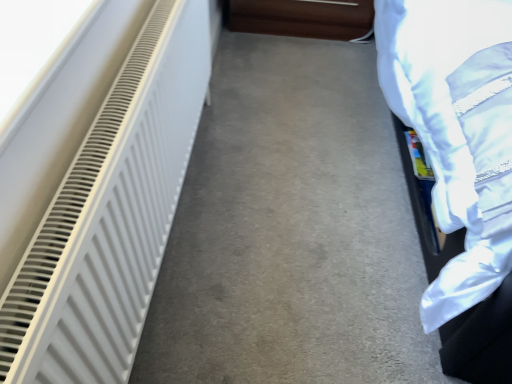
Question: From the image's perspective, is white matte radiator at left located above or below white matte radiator at left?

Choices:
 (A) below
 (B) above

Answer: (A)

Question: Looking at the image, does white matte radiator at left seem bigger or smaller compared to white matte radiator at left?

Choices:
 (A) big
 (B) small

Answer: (B)

Question: Which object is the closest to the brown leather couch at upper center?

Choices:
 (A) white matte radiator at left
 (B) white matte radiator at left

Answer: (B)

Question: Based on their relative distances, which object is nearer to the white matte radiator at left?

Choices:
 (A) white matte radiator at left
 (B) brown leather couch at upper center

Answer: (A)